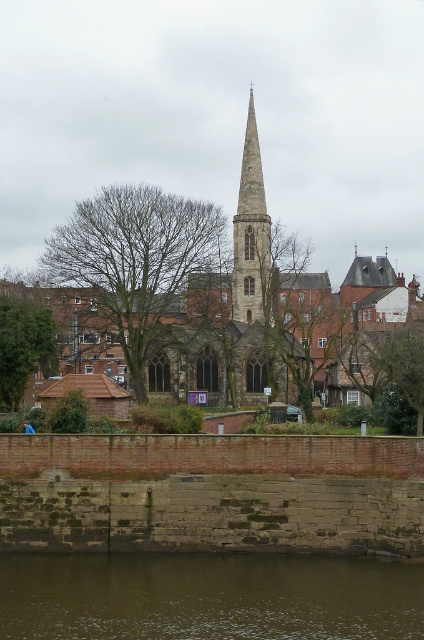
You are standing in front of the image and want to know if the bare branches at center are above or below the stone church at center. Can you tell me their positions relative to each other?

The bare branches at center is located below the stone church at center, so the branches are positioned underneath the church in the image.

You are standing at the base of the historic church and want to reach a specific point marked at coordinates point (114, 296). Given that the church spire is 180 feet tall, can you estimate how far you need to walk to reach that point?

The point (114, 296) is 323.61 feet away from the viewer, so you need to walk approximately 323.61 feet to reach it.

You are standing in front of the historic church and want to cross to the other side of the brown muddy water at lower center. The stone church at center is in your path. Can you walk around the church to reach the water?

The brown muddy water at lower center is positioned under the stone church at center, so you cannot physically walk around the church to reach the water as the church is above the water.